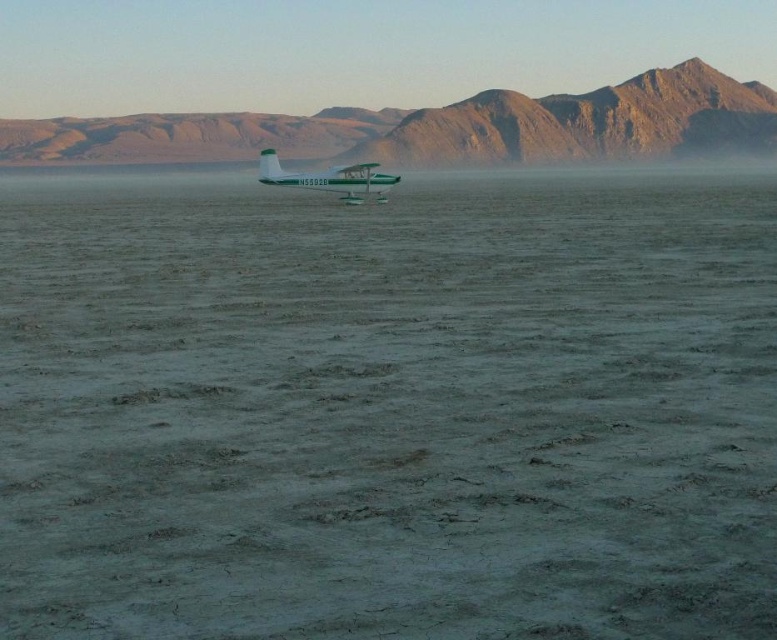
Based on the photo, you are a pilot trying to take off from the salt flat. You notice the rugged brown mountain at center and the green matte seaplane at center. Which object is closer to your current position on the salt flat?

The rugged brown mountain at center is closer to your current position on the salt flat because the green matte seaplane at center is positioned behind it.

Based on the scene description, which object takes up more area in the image between the gray matte sand at center and the rugged brown mountain at center?

The rugged brown mountain at center occupies more area than the gray matte sand at center according to the description.